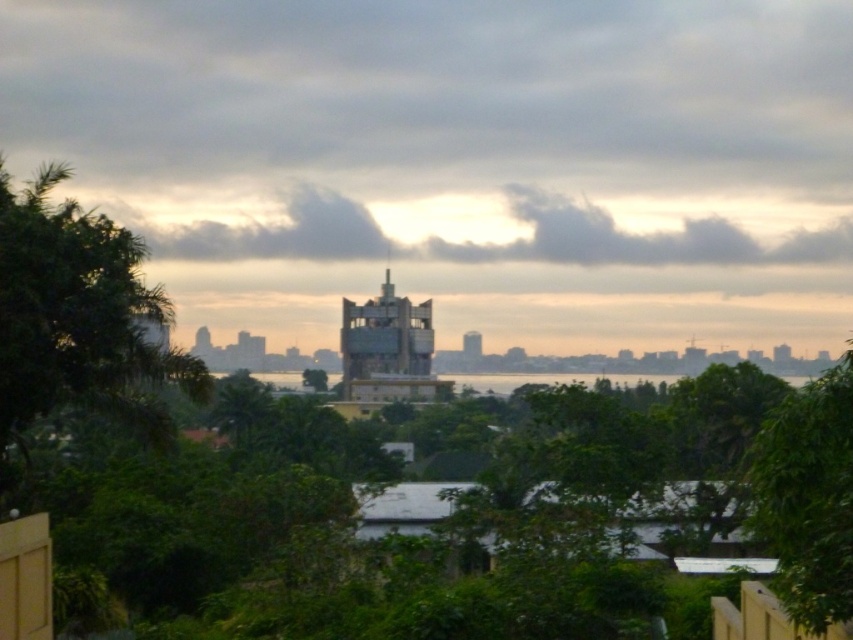
Which of these two, gray fluffy cloud at upper center or green leafy tree at lower right, stands shorter?

green leafy tree at lower right

Does gray fluffy cloud at upper center lie in front of green leafy tree at lower right?

No, it is not.

Locate an element on the screen. This screenshot has width=853, height=640. gray fluffy cloud at upper center is located at coordinates (492, 241).

At what (x,y) coordinates should I click in order to perform the action: click on gray fluffy cloud at upper center. Please return your answer as a coordinate pair (x, y). Looking at the image, I should click on (492, 241).

Does green leafy tree at lower right have a larger size compared to smooth concrete tower at center?

Yes, green leafy tree at lower right is bigger than smooth concrete tower at center.

Between green leafy tree at lower right and smooth concrete tower at center, which one is positioned higher?

smooth concrete tower at center

Is point (761, 538) behind point (479, 332)?

No, it is not.

The image size is (853, 640). I want to click on green leafy tree at lower right, so click(808, 497).

Is green leafy tree at lower right taller than green leafy tree at center?

Yes, green leafy tree at lower right is taller than green leafy tree at center.

Does green leafy tree at lower right have a greater width compared to green leafy tree at center?

Yes, green leafy tree at lower right is wider than green leafy tree at center.

Does point (790, 608) come behind point (312, 376)?

No, it is not.

The height and width of the screenshot is (640, 853). I want to click on green leafy tree at lower right, so click(808, 497).